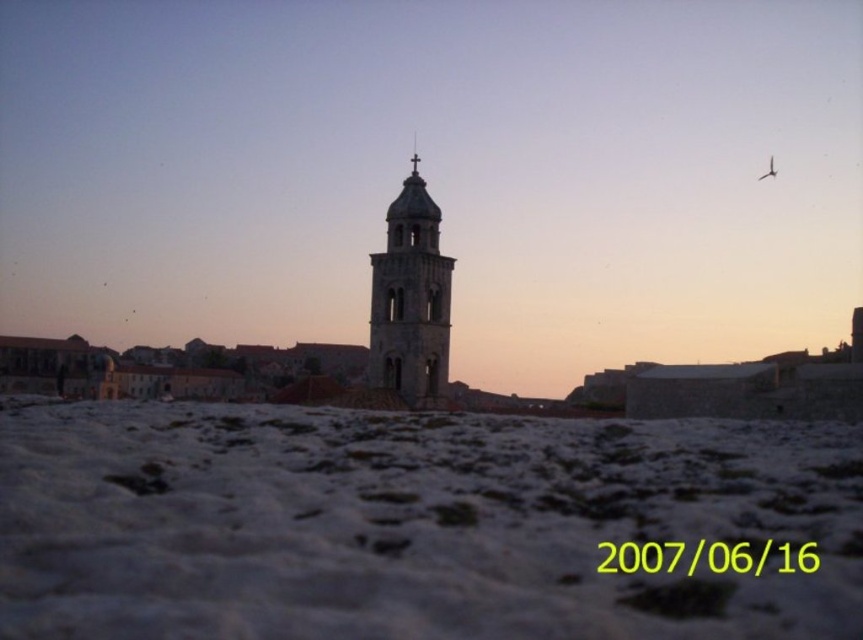
Question: Is white powdery snow at lower center to the right of smooth stone bell tower at center from the viewer's perspective?

Choices:
 (A) no
 (B) yes

Answer: (B)

Question: Can you confirm if white powdery snow at lower center is smaller than smooth stone bell tower at center?

Choices:
 (A) no
 (B) yes

Answer: (A)

Question: Can you confirm if white powdery snow at lower center is positioned above smooth stone bell tower at center?

Choices:
 (A) yes
 (B) no

Answer: (B)

Question: Which point appears closest to the camera in this image?

Choices:
 (A) (257, 627)
 (B) (446, 262)

Answer: (A)